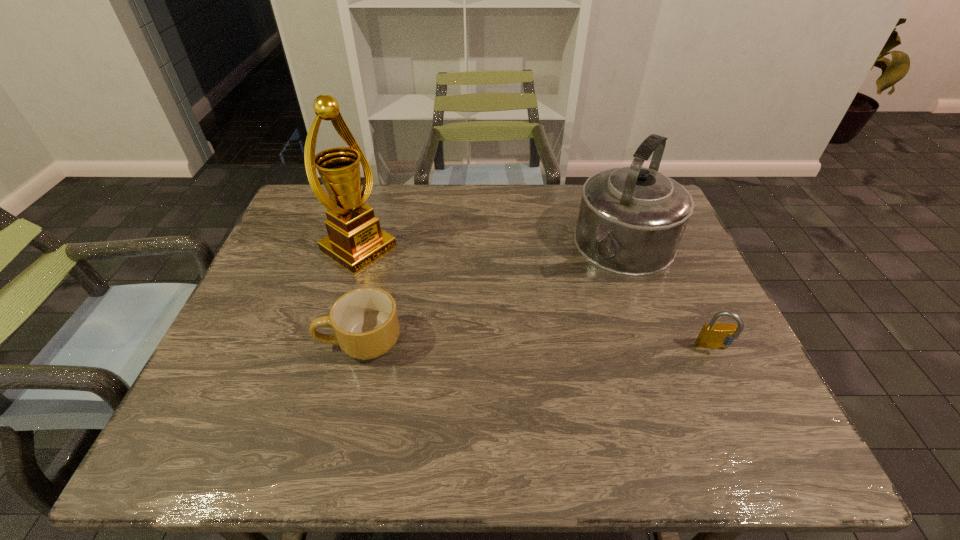
Image resolution: width=960 pixels, height=540 pixels. I want to click on object that is at the far right corner, so click(631, 220).

Locate an element on the screen. vacant space at the far edge of the desktop is located at coordinates (423, 186).

The width and height of the screenshot is (960, 540). In the image, there is a desktop. In order to click on free space at the near edge in this screenshot , I will do `click(327, 383)`.

Where is `vacant space at the left edge`? vacant space at the left edge is located at coordinates (310, 270).

At what (x,y) coordinates should I click in order to perform the action: click on vacant space at the right edge. Please return your answer as a coordinate pair (x, y). The width and height of the screenshot is (960, 540). Looking at the image, I should click on (664, 328).

The height and width of the screenshot is (540, 960). In the image, there is a desktop. Identify the location of vacant area at the far left corner. (300, 222).

I want to click on vacant area at the near right corner, so click(723, 402).

Find the location of a particular element. This screenshot has height=540, width=960. vacant space in between the second tallest object and the shortest object is located at coordinates (493, 294).

Locate an element on the screen. vacant space that is in between the kettle and the padlock is located at coordinates (670, 298).

This screenshot has width=960, height=540. I want to click on unoccupied area between the padlock and the tallest object, so click(x=537, y=299).